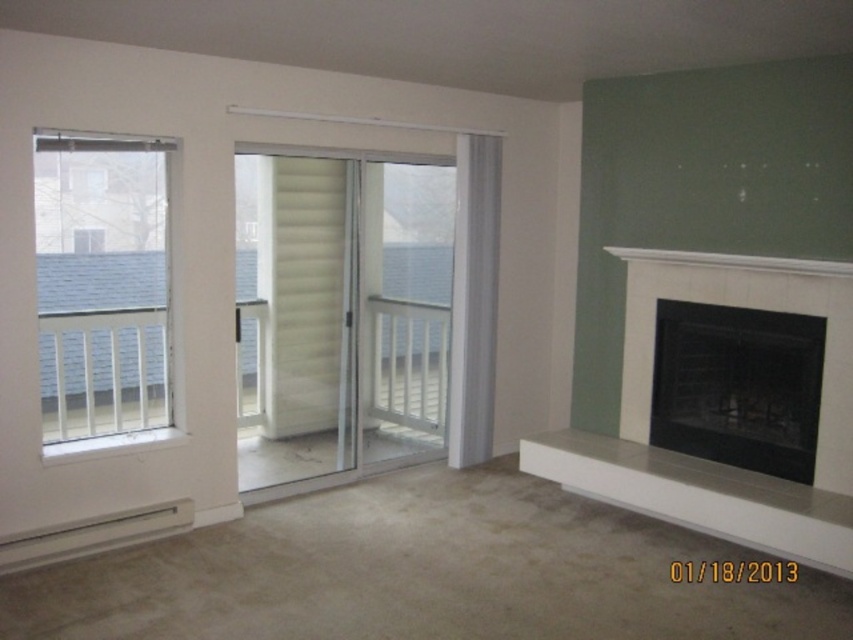
Does clear glass sliding door at center have a greater width compared to black glass fireplace at right?

Yes, clear glass sliding door at center is wider than black glass fireplace at right.

Can you confirm if clear glass sliding door at center is positioned below black glass fireplace at right?

Incorrect, clear glass sliding door at center is not positioned below black glass fireplace at right.

Between point (310, 426) and point (701, 422), which one is positioned in front?

Point (701, 422)

At what (x,y) coordinates should I click in order to perform the action: click on clear glass sliding door at center. Please return your answer as a coordinate pair (x, y). Image resolution: width=853 pixels, height=640 pixels. Looking at the image, I should click on (340, 312).

Where is `white wood window at left`? The width and height of the screenshot is (853, 640). white wood window at left is located at coordinates (102, 285).

Between white wood window at left and white glossy sliding door at center, which one appears on the left side from the viewer's perspective?

white wood window at left

Is point (82, 353) closer to camera compared to point (730, 486)?

That is False.

The image size is (853, 640). What are the coordinates of `white wood window at left` in the screenshot? It's located at (102, 285).

Is clear glass sliding door at center to the left of white wood window at left from the viewer's perspective?

Incorrect, clear glass sliding door at center is not on the left side of white wood window at left.

Is clear glass sliding door at center to the right of white wood window at left from the viewer's perspective?

Yes, clear glass sliding door at center is to the right of white wood window at left.

Which is behind, point (323, 445) or point (109, 314)?

The point (323, 445) is more distant.

In order to click on clear glass sliding door at center in this screenshot , I will do `click(340, 312)`.